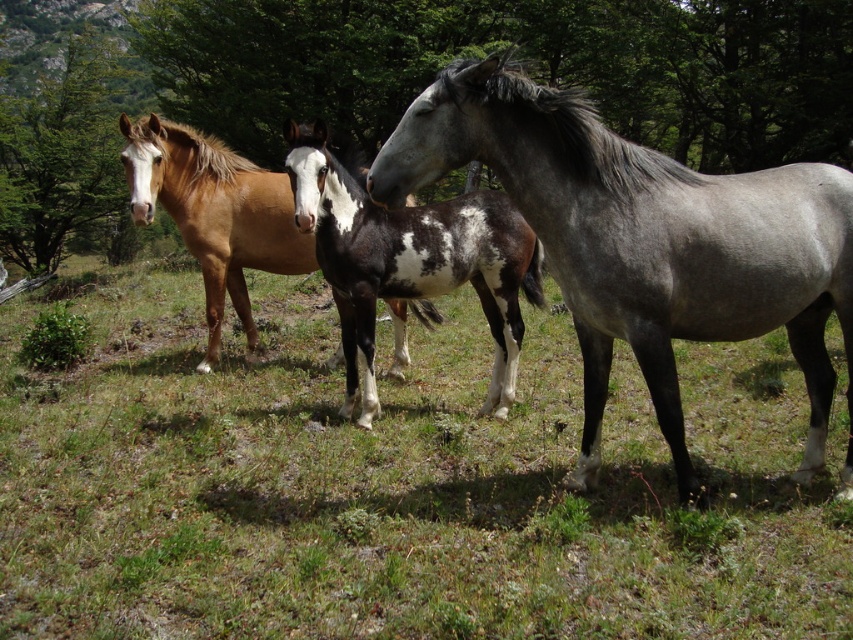
Question: Does gray smooth horse at center appear over gray matte horse at right?

Choices:
 (A) no
 (B) yes

Answer: (A)

Question: Which point is farther to the camera?

Choices:
 (A) (100, 100)
 (B) (373, 412)
 (C) (782, 74)
 (D) (643, 433)

Answer: (A)

Question: Which of the following is the farthest from the observer?

Choices:
 (A) green leafy tree at upper center
 (B) green leafy tree at left
 (C) gray smooth horse at center
 (D) spotted glossy horse at center

Answer: (B)

Question: Does spotted glossy horse at center have a lesser width compared to brown glossy horse at center?

Choices:
 (A) no
 (B) yes

Answer: (A)

Question: Is green leafy tree at upper center to the right of green leafy tree at left from the viewer's perspective?

Choices:
 (A) no
 (B) yes

Answer: (B)

Question: Which object appears farthest from the camera in this image?

Choices:
 (A) gray matte horse at right
 (B) green leafy tree at left
 (C) brown glossy horse at center

Answer: (B)